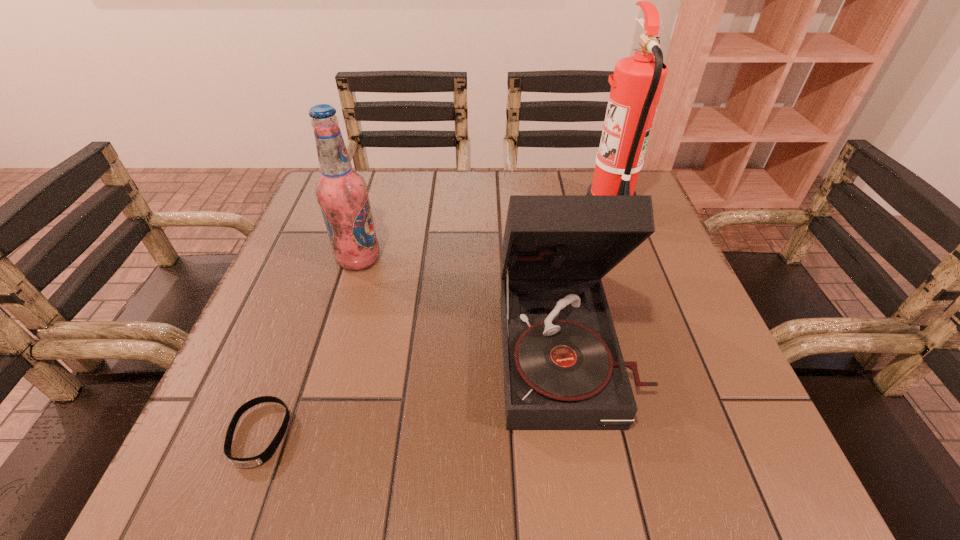
I want to click on empty location between the shortest object and the second farthest object, so click(x=309, y=347).

Locate an element on the screen. The height and width of the screenshot is (540, 960). empty space between the phonograph_record and the wristband is located at coordinates (415, 391).

Identify the location of vacant space that's between the wristband and the phonograph_record. Image resolution: width=960 pixels, height=540 pixels. (415, 391).

Locate an element on the screen. The width and height of the screenshot is (960, 540). free spot between the second farthest object and the phonograph_record is located at coordinates (464, 303).

Where is `object that can be found as the closest to the phonograph_record`? Image resolution: width=960 pixels, height=540 pixels. object that can be found as the closest to the phonograph_record is located at coordinates (636, 86).

Locate an element on the screen. The width and height of the screenshot is (960, 540). object that ranks as the third closest to the tallest object is located at coordinates (260, 459).

At what (x,y) coordinates should I click in order to perform the action: click on free space that satisfies the following two spatial constraints: 1. at the nozzle of the fire extinguisher; 2. on the display of the shortest object. Please return your answer as a coordinate pair (x, y). Looking at the image, I should click on (691, 434).

In order to click on free space that satisfies the following two spatial constraints: 1. at the nozzle of the tallest object; 2. on the front-facing side of the phonograph_record in this screenshot , I will do `click(660, 348)`.

What are the coordinates of `free space that satisfies the following two spatial constraints: 1. at the nozzle of the tallest object; 2. on the front side of the alcohol` in the screenshot? It's located at click(x=628, y=259).

What are the coordinates of `vacant space that satisfies the following two spatial constraints: 1. at the nozzle of the tallest object; 2. on the display of the shortest object` in the screenshot? It's located at point(691,434).